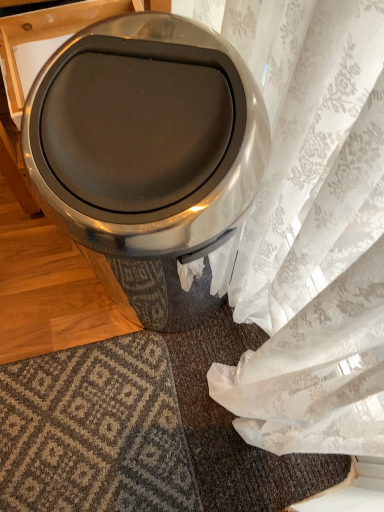
Find the location of a particular element. Image resolution: width=384 pixels, height=512 pixels. vacant area situated to the left side of brushed metal trash can at center is located at coordinates (40, 284).